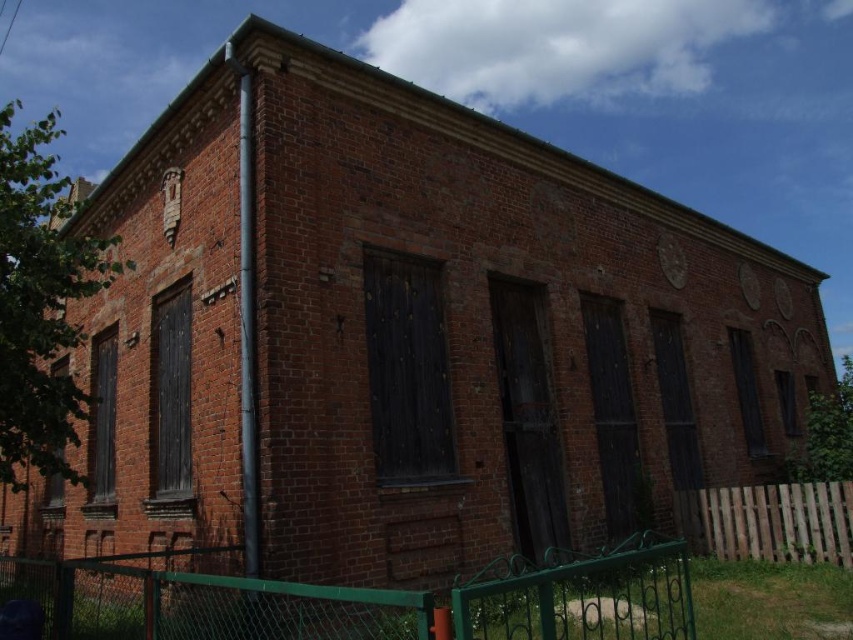
Question: Does green metal fence at lower center appear over brown wooden fence at lower right?

Choices:
 (A) no
 (B) yes

Answer: (B)

Question: Among these points, which one is farthest from the camera?

Choices:
 (A) (544, 628)
 (B) (759, 516)

Answer: (B)

Question: Does green metal fence at lower center appear on the left side of brown wooden fence at lower right?

Choices:
 (A) yes
 (B) no

Answer: (A)

Question: In this image, where is green metal fence at lower center located relative to brown wooden fence at lower right?

Choices:
 (A) left
 (B) right

Answer: (A)

Question: Which point is farther to the camera?

Choices:
 (A) green metal fence at lower center
 (B) brown wooden fence at lower right

Answer: (B)